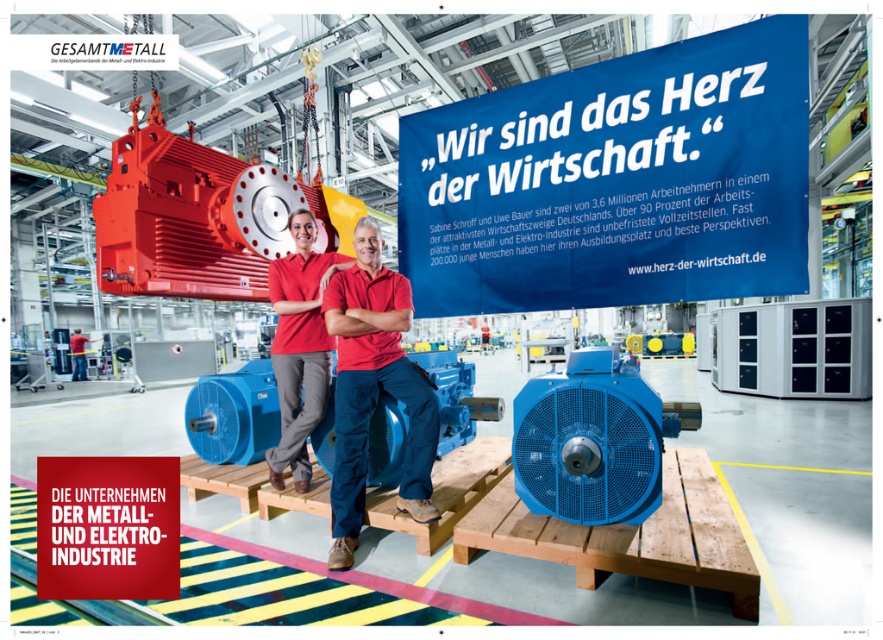
Question: Among these points, which one is farthest from the camera?

Choices:
 (A) (288, 422)
 (B) (364, 314)

Answer: (A)

Question: Which of the following is the farthest from the observer?

Choices:
 (A) red fabric shirt at center
 (B) red smooth shirt at center

Answer: (B)

Question: Is the position of red fabric shirt at center less distant than that of red smooth shirt at center?

Choices:
 (A) no
 (B) yes

Answer: (B)

Question: Does red fabric shirt at center appear on the right side of red smooth shirt at center?

Choices:
 (A) yes
 (B) no

Answer: (A)

Question: Which of the following is the closest to the observer?

Choices:
 (A) (404, 378)
 (B) (293, 464)

Answer: (A)

Question: Is red fabric shirt at center to the right of red smooth shirt at center from the viewer's perspective?

Choices:
 (A) yes
 (B) no

Answer: (A)